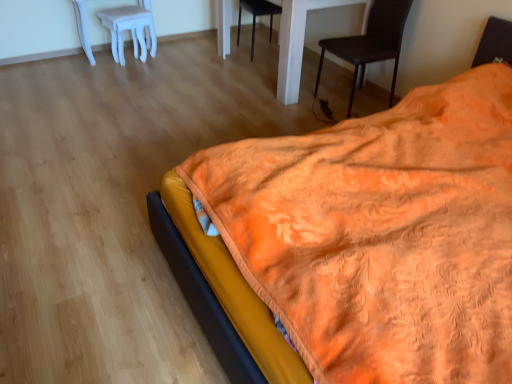
Question: From a real-world perspective, is orange textured blanket at lower right beneath black leather chair at upper right, which appears as the second chair when viewed from the left?

Choices:
 (A) no
 (B) yes

Answer: (A)

Question: Is orange textured blanket at lower right touching black leather chair at upper right, which is the 1th chair in right-to-left order?

Choices:
 (A) no
 (B) yes

Answer: (A)

Question: Considering the relative positions of orange textured blanket at lower right and black leather chair at upper right, which appears as the first chair when viewed from the front, in the image provided, is orange textured blanket at lower right to the left of black leather chair at upper right, which appears as the first chair when viewed from the front, from the viewer's perspective?

Choices:
 (A) no
 (B) yes

Answer: (B)

Question: From the image's perspective, does orange textured blanket at lower right appear higher than black leather chair at upper right, which ranks as the 2th chair in back-to-front order?

Choices:
 (A) yes
 (B) no

Answer: (B)

Question: Is orange textured blanket at lower right oriented away from black leather chair at upper right, which appears as the second chair when viewed from the left?

Choices:
 (A) no
 (B) yes

Answer: (A)

Question: Does orange textured blanket at lower right have a larger size compared to black leather chair at upper right, which is the 1th chair in right-to-left order?

Choices:
 (A) yes
 (B) no

Answer: (A)

Question: Does orange textured blanket at lower right appear on the right side of black matte chair at center, acting as the second chair starting from the front?

Choices:
 (A) yes
 (B) no

Answer: (A)

Question: From a real-world perspective, is orange textured blanket at lower right positioned over black matte chair at center, the 1th chair viewed from the left, based on gravity?

Choices:
 (A) yes
 (B) no

Answer: (A)

Question: From the image's perspective, is orange textured blanket at lower right located above black matte chair at center, arranged as the 2th chair when viewed from the right?

Choices:
 (A) yes
 (B) no

Answer: (B)

Question: Is orange textured blanket at lower right not near black matte chair at center, the 1th chair viewed from the left?

Choices:
 (A) yes
 (B) no

Answer: (A)

Question: Can you confirm if orange textured blanket at lower right is smaller than black matte chair at center, acting as the second chair starting from the front?

Choices:
 (A) yes
 (B) no

Answer: (B)

Question: From the image's perspective, would you say orange textured blanket at lower right is shown under black matte chair at center, acting as the 1th chair starting from the back?

Choices:
 (A) yes
 (B) no

Answer: (A)

Question: Is the depth of white glossy table at center less than that of black matte chair at center, acting as the 1th chair starting from the back?

Choices:
 (A) yes
 (B) no

Answer: (A)